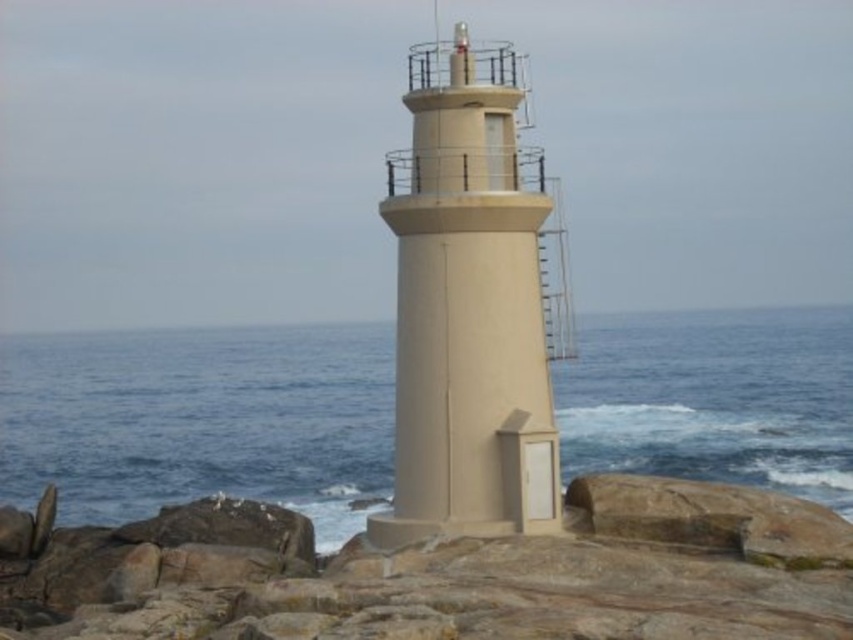
You are a maintenance worker needing to place a 2 meter wide equipment container between the brown rock at center and the beige concrete tower at center. Can the container fit between them?

The brown rock at center is wider than the beige concrete tower at center, but the exact distance between them isn not specified. Without knowing the space between the two objects, it is impossible to determine if the container will fit.